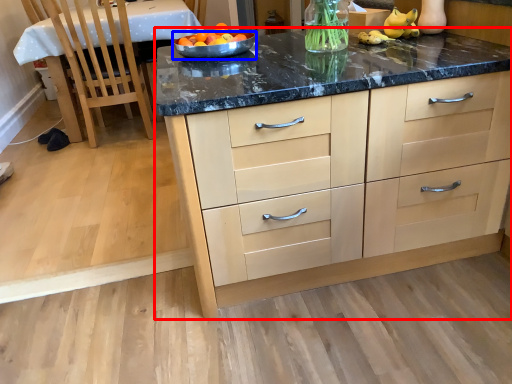
Question: Which point is closer to the camera, cabinetry (highlighted by a red box) or bowl (highlighted by a blue box)?

Choices:
 (A) cabinetry
 (B) bowl

Answer: (A)